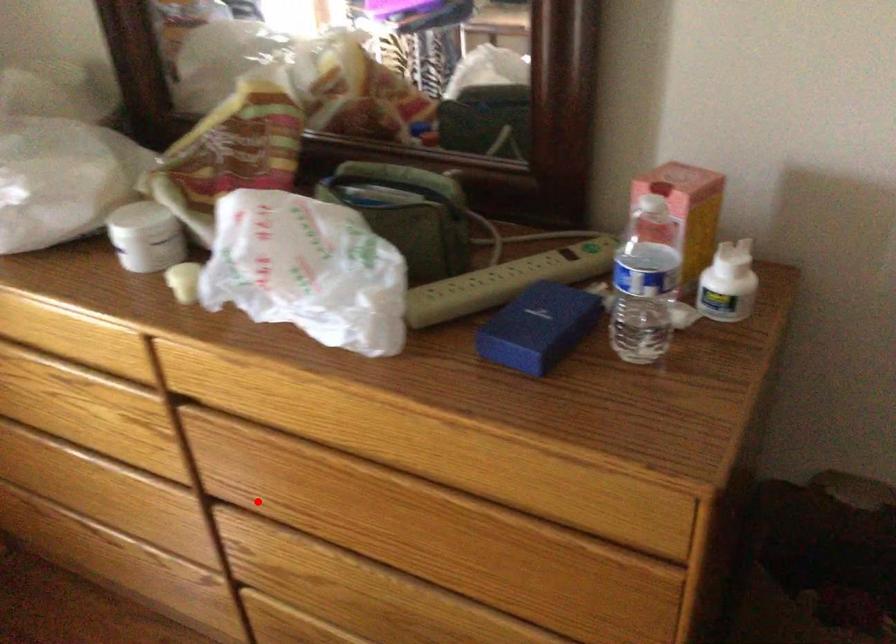
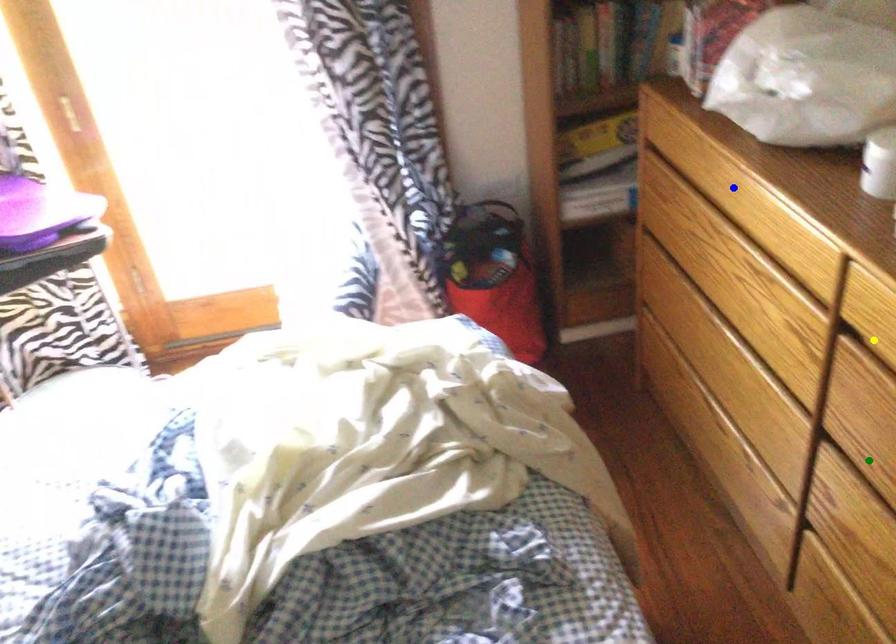
Question: I am providing you with two images of the same scene from different viewpoints. A red point is marked on the first image. You are given multiple points on the second image. Which point in image 2 is actually the same real-world point as the red point in image 1?

Choices:
 (A) green point
 (B) blue point
 (C) yellow point

Answer: (A)